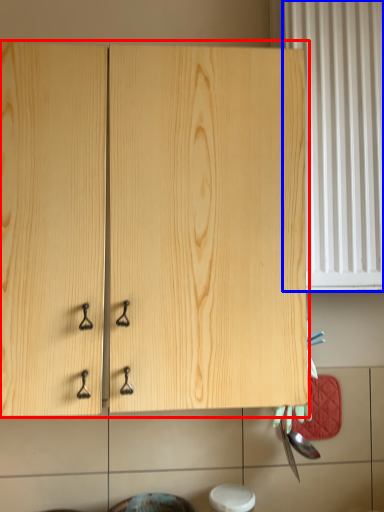
Question: Among these objects, which one is farthest to the camera, cabinetry (highlighted by a red box) or curtain (highlighted by a blue box)?

Choices:
 (A) cabinetry
 (B) curtain

Answer: (B)